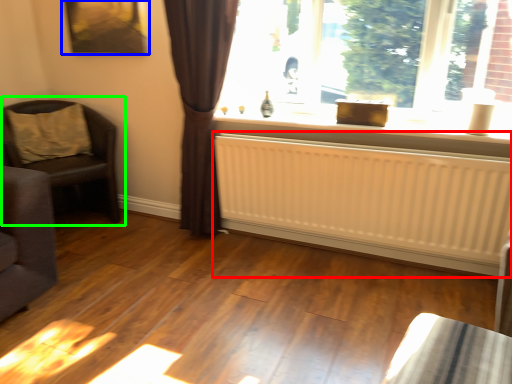
Question: Which object is the closest to the radiator (highlighted by a red box)? Choose among these: picture frame (highlighted by a blue box) or chair (highlighted by a green box).

Choices:
 (A) picture frame
 (B) chair

Answer: (B)